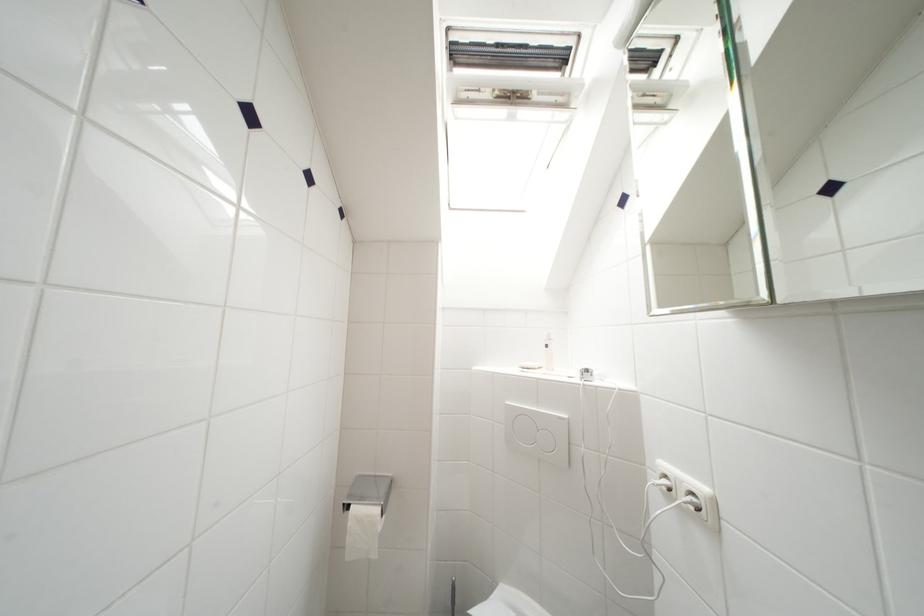
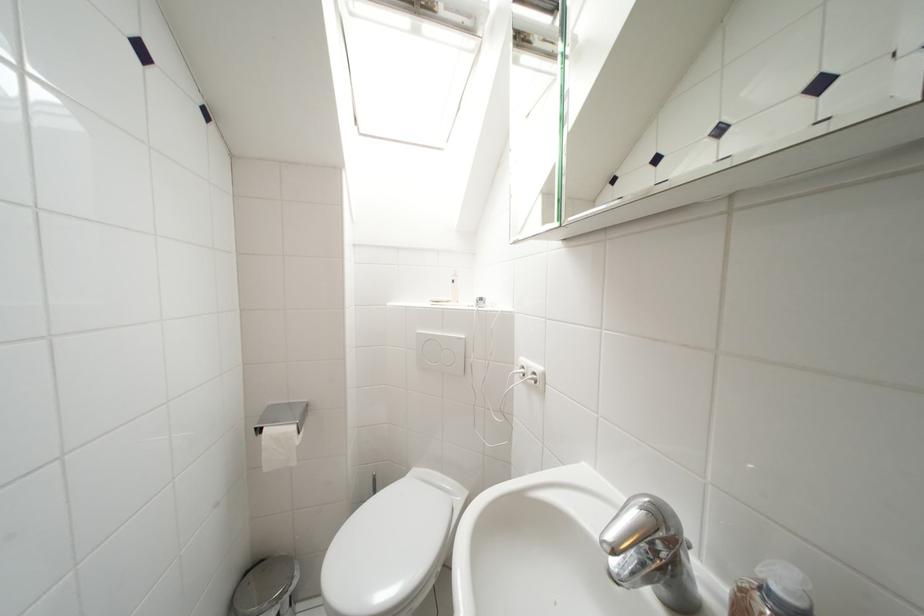
In the second image, find the point that corresponds to point 369,503 in the first image.

(283, 424)